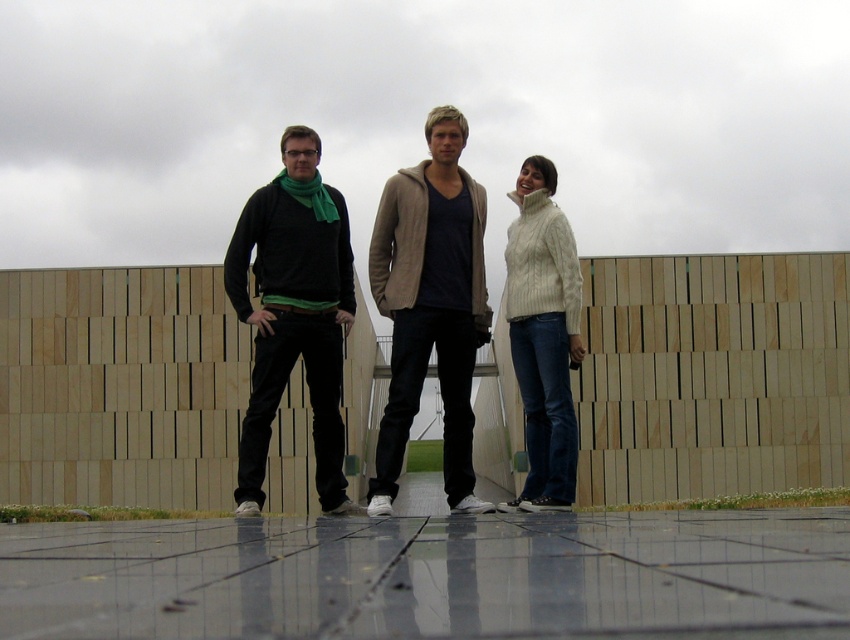
Is point (418, 209) more distant than point (299, 257)?

That is False.

Who is positioned more to the right, light brown knitted sweater at center or matte black sweater at center?

light brown knitted sweater at center is more to the right.

Find the location of a particular element. light brown knitted sweater at center is located at coordinates (429, 305).

Which is in front, point (435, 326) or point (392, 381)?

Point (392, 381) is more forward.

Which is more to the left, matte black pants at center or light brown knitted sweater at center?

matte black pants at center

Who is more distant from viewer, (408, 291) or (442, 356)?

The point (408, 291) is behind.

This screenshot has width=850, height=640. I want to click on matte black pants at center, so click(429, 304).

Who is lower down, light brown knitted sweater at center or white cable-knit sweater at center?

light brown knitted sweater at center is lower down.

Does light brown knitted sweater at center have a lesser width compared to white cable-knit sweater at center?

No.

This screenshot has height=640, width=850. What do you see at coordinates (429, 305) in the screenshot?
I see `light brown knitted sweater at center` at bounding box center [429, 305].

You are a GUI agent. You are given a task and a screenshot of the screen. Output one action in this format:
    pyautogui.click(x=<x>, y=<y>)
    Task: Click on the light brown knitted sweater at center
    
    Given the screenshot: What is the action you would take?
    pyautogui.click(x=429, y=305)